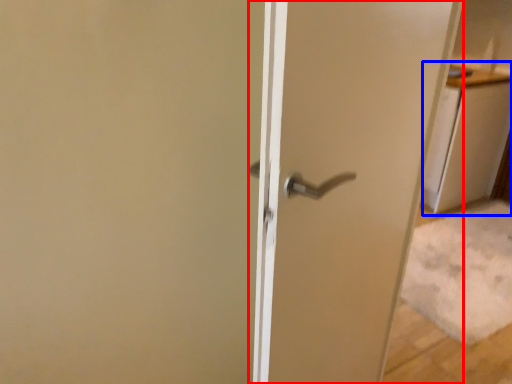
Question: Which of the following is the closest to the observer, door (highlighted by a red box) or cabinetry (highlighted by a blue box)?

Choices:
 (A) door
 (B) cabinetry

Answer: (A)